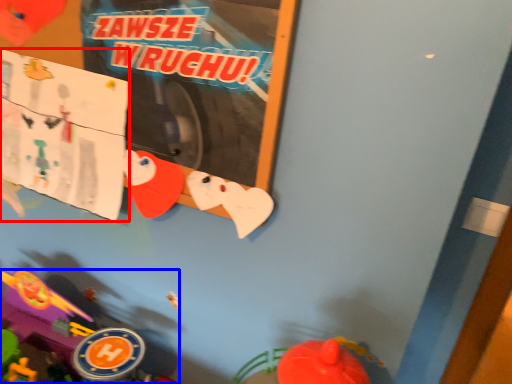
Question: Which object is further to the camera taking this photo, poster page (highlighted by a red box) or toy (highlighted by a blue box)?

Choices:
 (A) poster page
 (B) toy

Answer: (A)